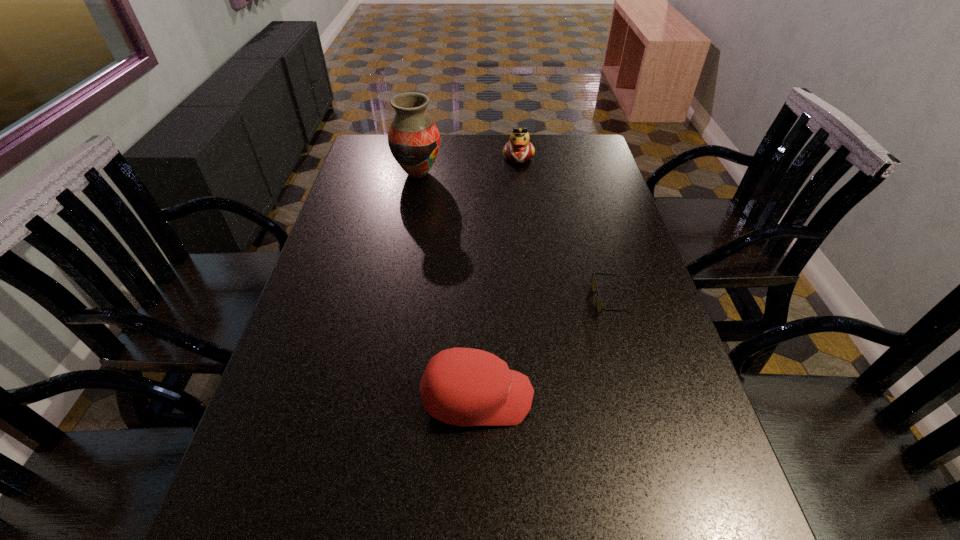
Find the location of a particular element. The height and width of the screenshot is (540, 960). free location at the right edge is located at coordinates (627, 381).

In order to click on vacant space at the far right corner in this screenshot , I will do `click(583, 148)`.

This screenshot has height=540, width=960. I want to click on vacant region between the shortest object and the nearest object, so click(543, 349).

Find the location of `unoccupied position between the vase and the duck`. unoccupied position between the vase and the duck is located at coordinates (468, 165).

The height and width of the screenshot is (540, 960). I want to click on vacant region between the duck and the tallest object, so click(x=468, y=165).

This screenshot has width=960, height=540. I want to click on vacant space that is in between the nearest object and the rightmost object, so click(543, 349).

What are the coordinates of `vacant area that lies between the cap and the leftmost object` in the screenshot? It's located at (447, 285).

Identify the location of free spot between the duck and the rightmost object. (564, 228).

I want to click on free spot between the vase and the duck, so click(468, 165).

Locate an element on the screen. free point between the duck and the nearest object is located at coordinates (498, 277).